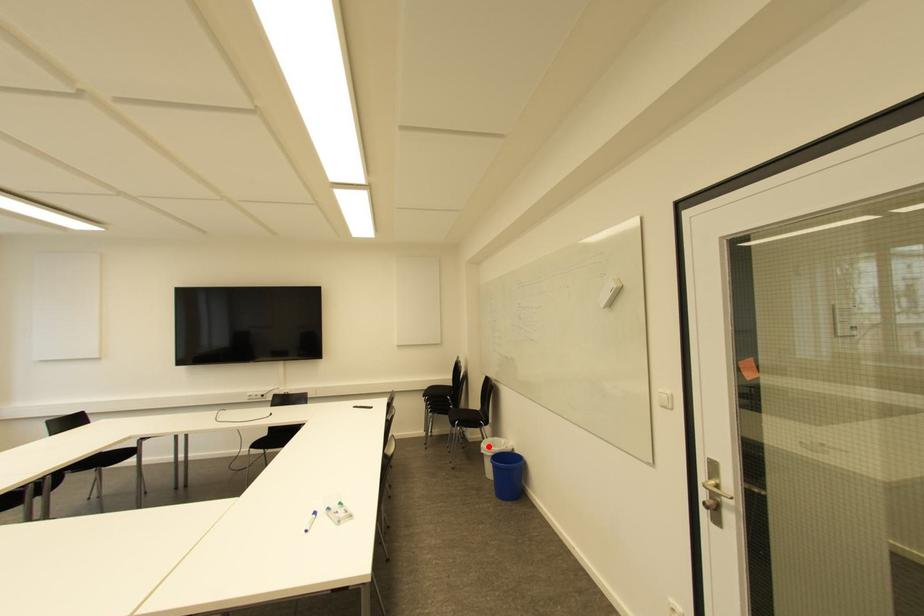
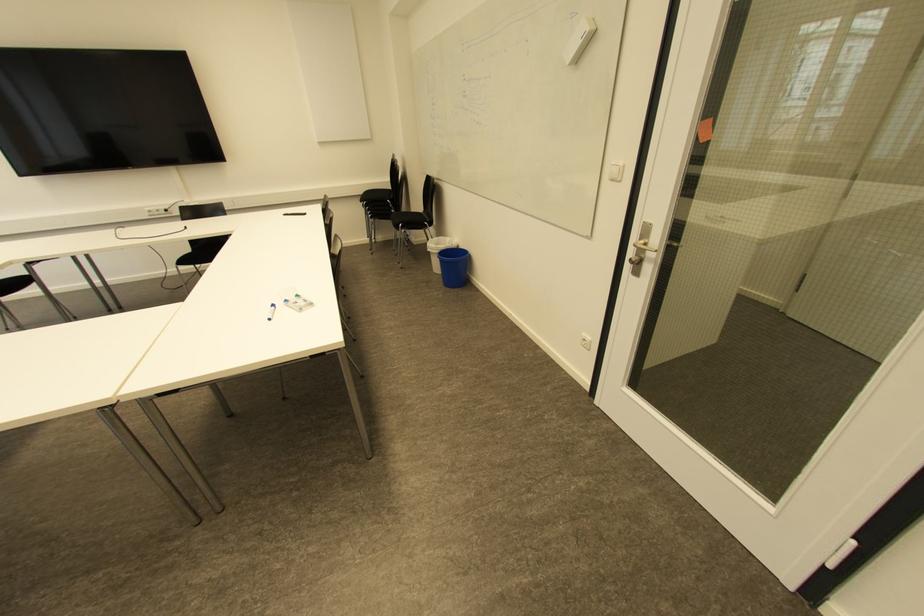
In the second image, find the point that corresponds to the highlighted location in the first image.

(434, 245)